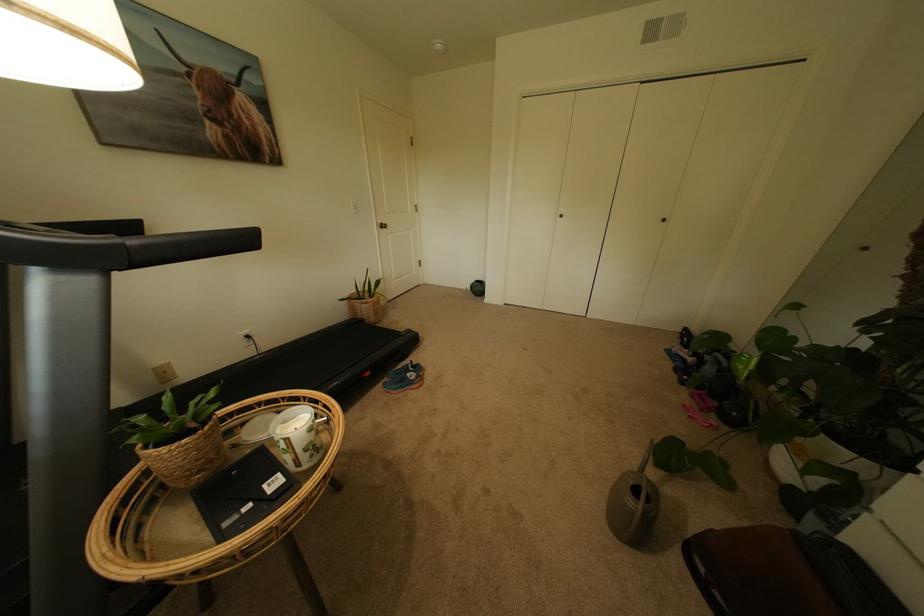
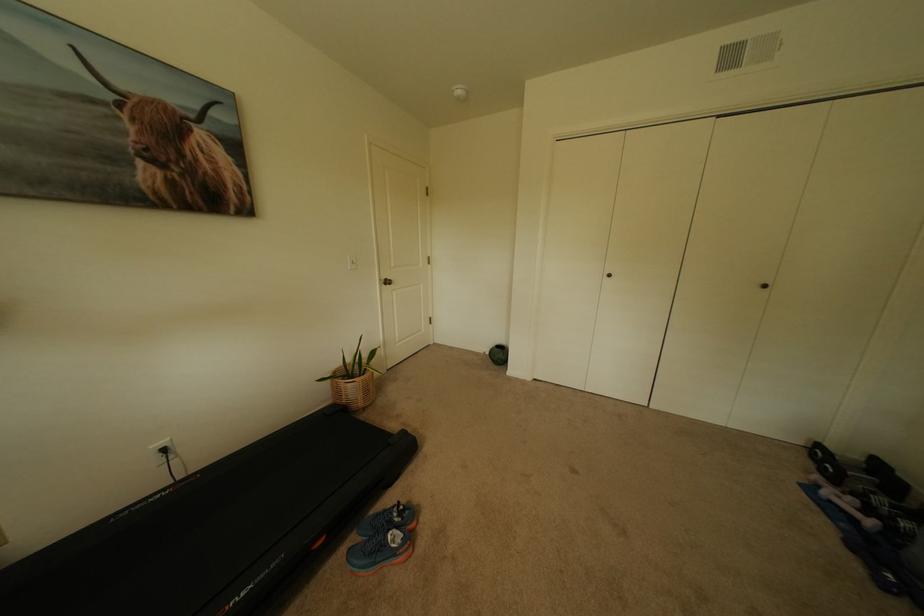
Question: The first image is from the beginning of the video and the second image is from the end. How did the camera likely rotate when shooting the video?

Choices:
 (A) Left
 (B) Right
 (C) Up
 (D) Down

Answer: (C)